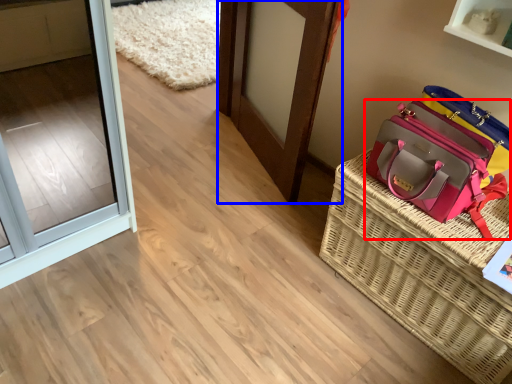
Question: Which point is closer to the camera, handbag (highlighted by a red box) or door (highlighted by a blue box)?

Choices:
 (A) handbag
 (B) door

Answer: (A)